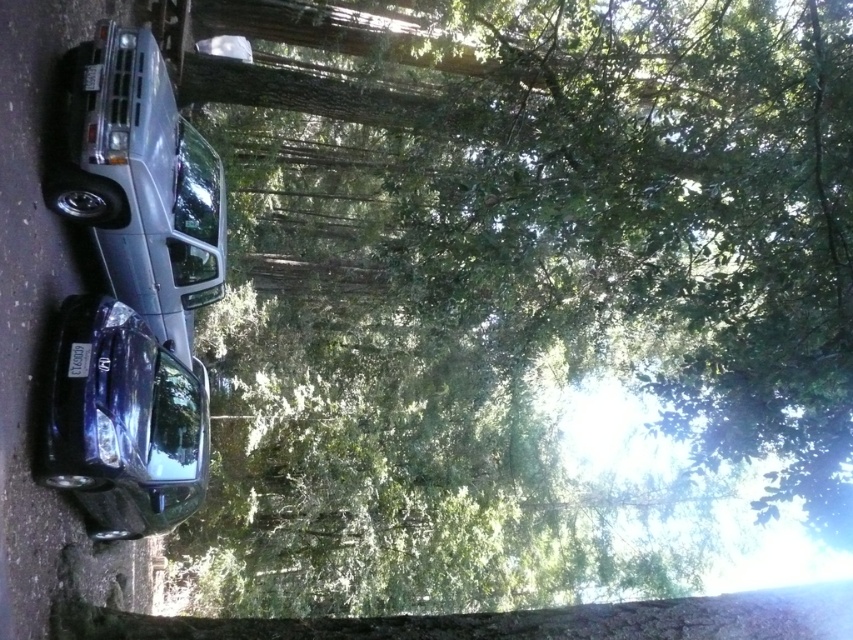
You are a hiker who wants to take a photo of the satin silver suv at left and the glossy metallic car at lower left from the forest path. Which vehicle should you position yourself closer to in order to capture both in the same frame?

To capture both the satin silver suv at left and the glossy metallic car at lower left in the same frame, you should position yourself closer to the glossy metallic car at lower left since the satin silver suv at left is to the right of it, allowing both vehicles to be included within the camera view.

You are a photographer setting up a tripod to capture the two cars in the forest scene. Since the satin silver suv at left and the glossy metallic car at lower left are at different heights, which car will likely block the view of the other when positioned behind it?

The satin silver suv at left is much taller than the glossy metallic car at lower left, so if positioned behind the shorter car, the suv would block the view of the glossy metallic car at lower left.

You are standing at the point with coordinates point (141,182). Which object are you on?

You are on the satin silver suv at left because the point (141,182) is on the satin silver suv at left.